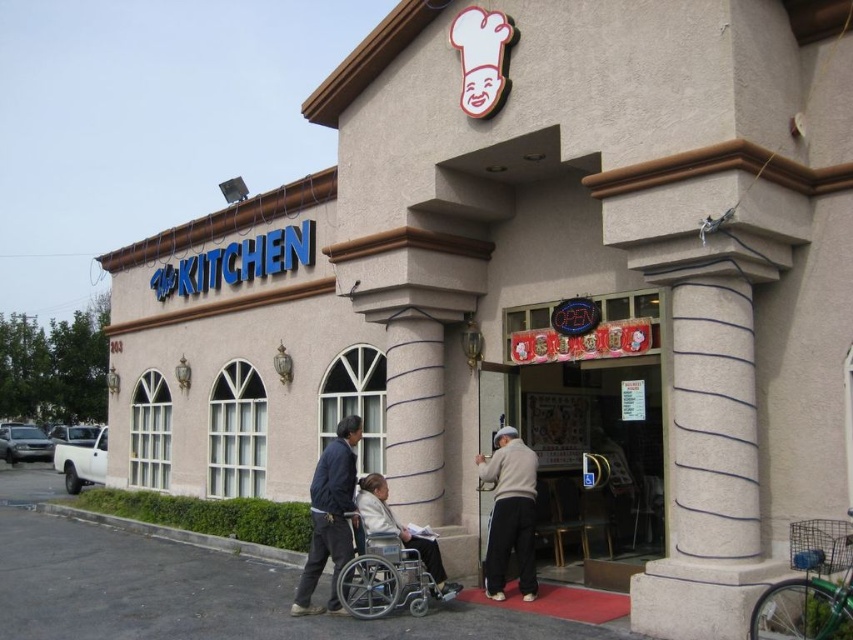
Question: Which of the following is the closest to the observer?

Choices:
 (A) tap(349, 602)
 (B) tap(310, 577)

Answer: (A)

Question: Which of the following is the farthest from the observer?

Choices:
 (A) white fabric wheelchair at lower center
 (B) dark blue jacket at center
 (C) silver metallic wheelchair at center
 (D) light gray sweater at entrance

Answer: (D)

Question: Can you confirm if light gray sweater at entrance is bigger than white fabric wheelchair at lower center?

Choices:
 (A) no
 (B) yes

Answer: (B)

Question: Which point appears farthest from the camera in this image?

Choices:
 (A) (338, 570)
 (B) (489, 593)
 (C) (456, 593)
 (D) (372, 573)

Answer: (B)

Question: Is light gray sweater at entrance wider than silver metallic wheelchair at center?

Choices:
 (A) yes
 (B) no

Answer: (B)

Question: Can you confirm if dark blue jacket at center is positioned below white fabric wheelchair at lower center?

Choices:
 (A) no
 (B) yes

Answer: (A)